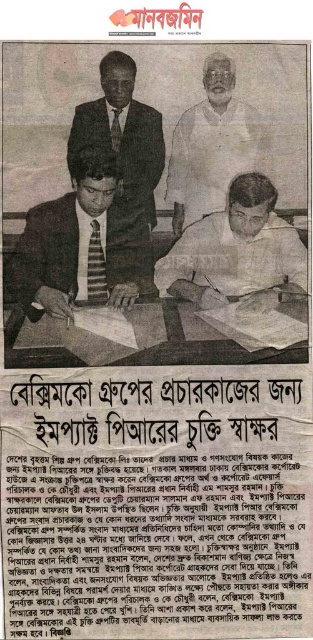
What is located at the point with coordinates (210,145) in the newspaper clipping?

The point at coordinates (210,145) indicates the white cotton shirt at center.

Based on the scene described, which object is positioned further away from the viewer between the white cotton shirt at center and the dark blue suit at center?

The dark blue suit at center is positioned further away from the viewer as it is behind the white cotton shirt at center.